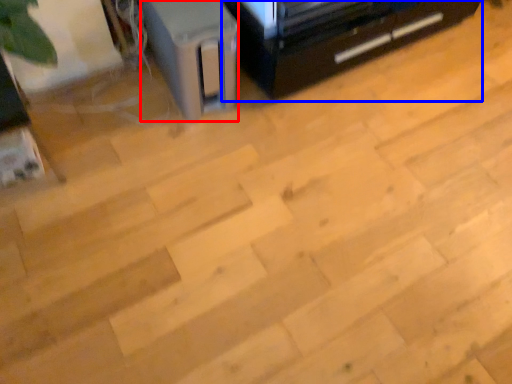
Question: Among these objects, which one is nearest to the camera, appliance (highlighted by a red box) or furniture (highlighted by a blue box)?

Choices:
 (A) appliance
 (B) furniture

Answer: (A)